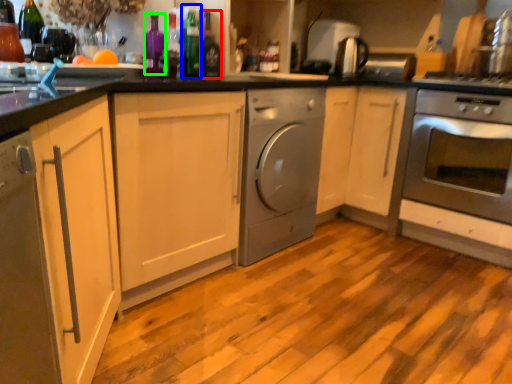
Question: Estimate the real-world distances between objects in this image. Which object is farther from bottle (highlighted by a red box), bottle (highlighted by a blue box) or bottle (highlighted by a green box)?

Choices:
 (A) bottle
 (B) bottle

Answer: (B)